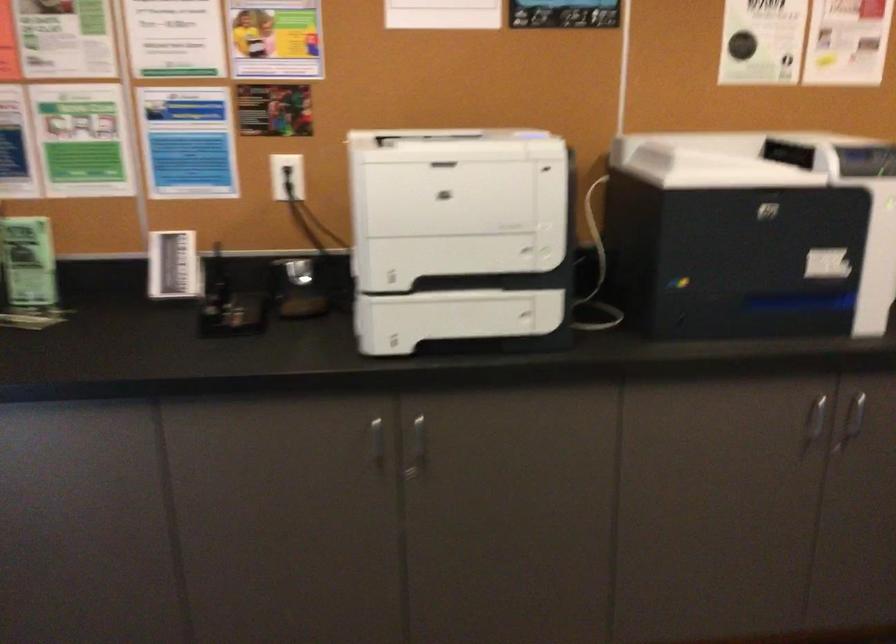
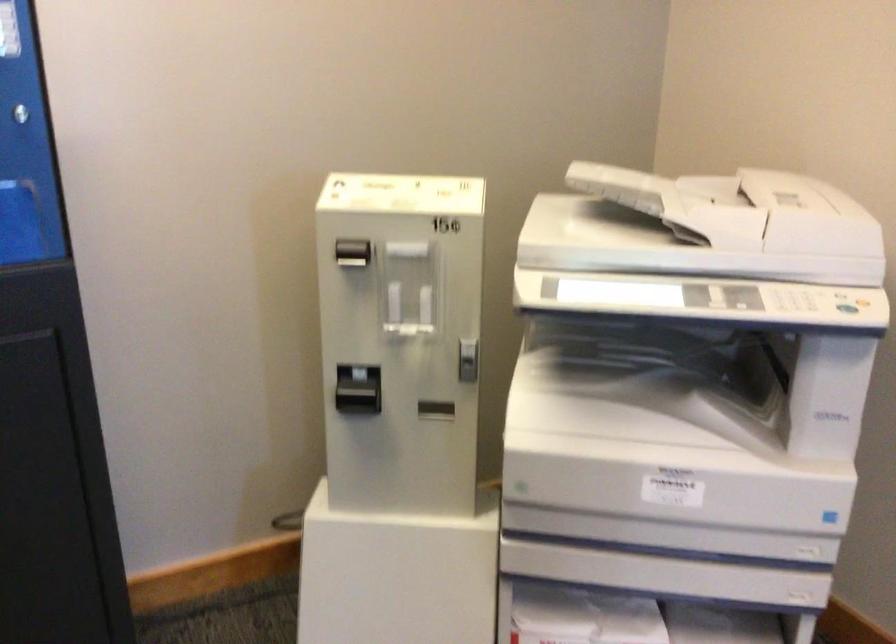
First-person continuous shooting, in which direction is the camera rotating?

The camera rotated toward right-down.